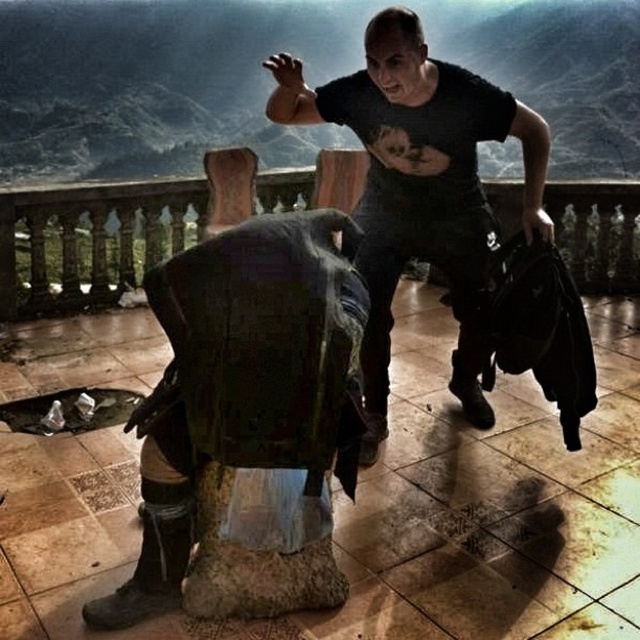
Is brushed metal railing at upper center to the left of polished stone balustrade at center from the viewer's perspective?

In fact, brushed metal railing at upper center is to the right of polished stone balustrade at center.

Locate an element on the screen. Image resolution: width=640 pixels, height=640 pixels. brushed metal railing at upper center is located at coordinates (269, 80).

Find the location of a particular element. Image resolution: width=640 pixels, height=640 pixels. brushed metal railing at upper center is located at coordinates (269, 80).

Which is more to the left, brushed metal railing at upper center or black matte t-shirt at upper center?

Positioned to the left is brushed metal railing at upper center.

Does brushed metal railing at upper center have a greater height compared to black matte t-shirt at upper center?

Yes, brushed metal railing at upper center is taller than black matte t-shirt at upper center.

The width and height of the screenshot is (640, 640). Describe the element at coordinates (269, 80) in the screenshot. I see `brushed metal railing at upper center` at that location.

I want to click on brushed metal railing at upper center, so click(x=269, y=80).

Does black matte t-shirt at upper center have a larger size compared to polished stone balustrade at center?

Correct, black matte t-shirt at upper center is larger in size than polished stone balustrade at center.

Is point (376, 454) farther from viewer compared to point (628, 237)?

No, it is not.

Where is `black matte t-shirt at upper center`? black matte t-shirt at upper center is located at coordinates (419, 186).